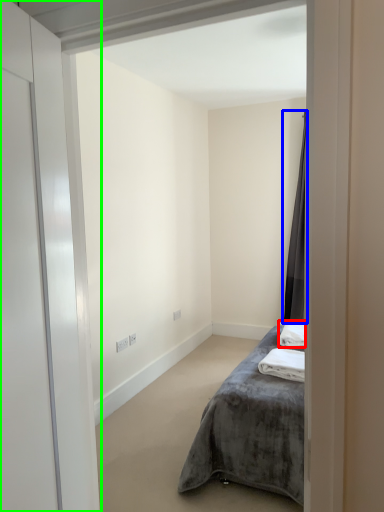
Question: Considering the real-world distances, which object is closest to bath towel (highlighted by a red box)? curtain (highlighted by a blue box) or door (highlighted by a green box).

Choices:
 (A) curtain
 (B) door

Answer: (A)